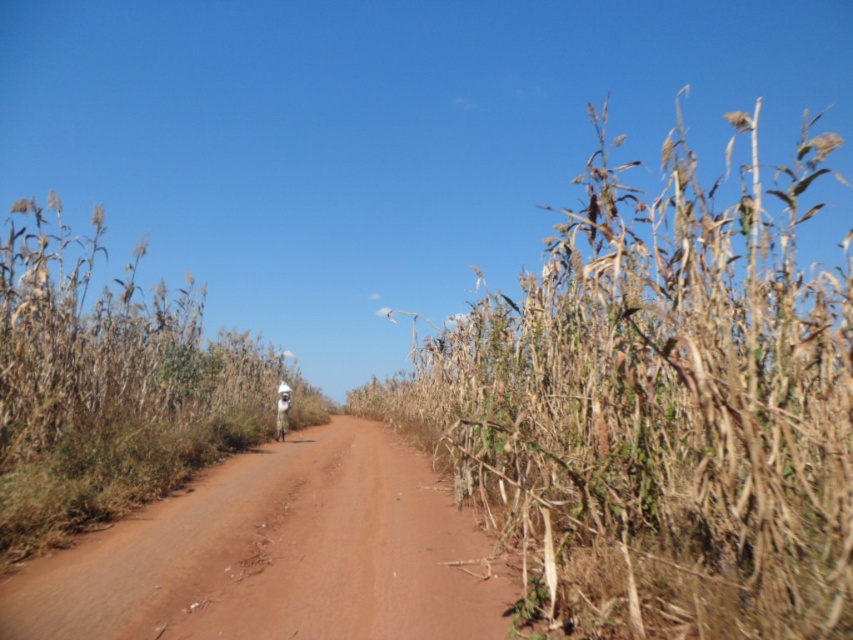
You are a hiker who wants to walk along the brown dirt track at center and the brown dry stalks of corn at center. Which path is on the left side?

The brown dry stalks of corn at center are on the left side of the brown dirt track at center, so the brown dry stalks of corn at center are on the left.

You are a farmer checking your crops. You see the brown dry stalks of corn at right and the brown dry stalks of corn at center. Which one is larger in size?

The brown dry stalks of corn at right is bigger than the brown dry stalks of corn at center.